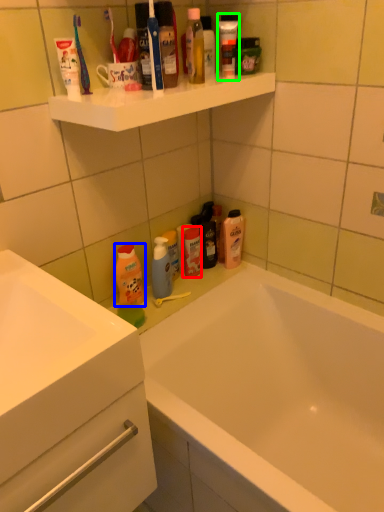
Question: Which object is positioned farthest from toiletry (highlighted by a red box)? Select from cleaning product (highlighted by a blue box) and toiletry (highlighted by a green box).

Choices:
 (A) cleaning product
 (B) toiletry

Answer: (B)